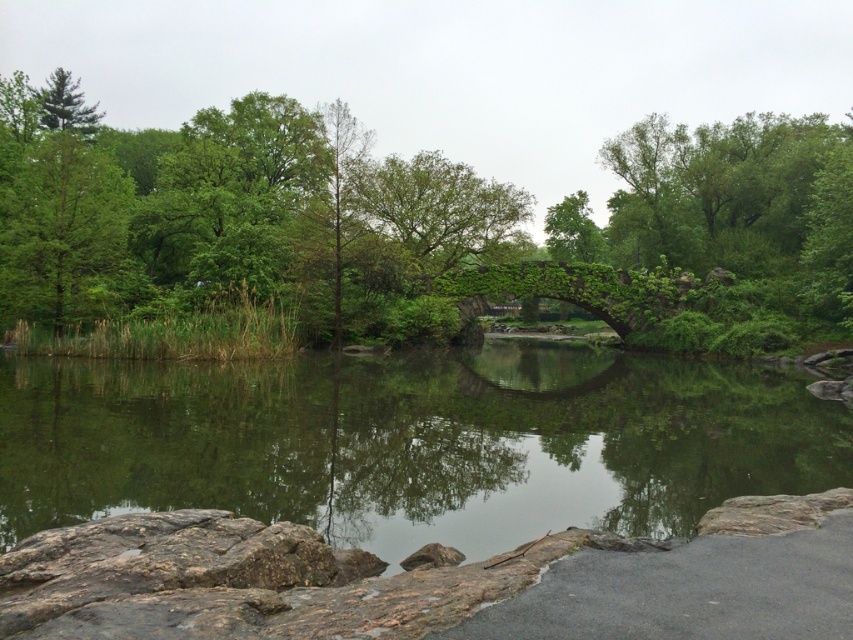
Question: Estimate the real-world distances between objects in this image. Which object is closer to the green ivy-covered bridge at center?

Choices:
 (A) green leafy tree at center
 (B) green reflective water at center

Answer: (A)

Question: Can you confirm if green leafy tree at center is wider than green ivy-covered bridge at center?

Choices:
 (A) yes
 (B) no

Answer: (A)

Question: Which of the following is the farthest from the observer?

Choices:
 (A) green reflective water at center
 (B) green leafy tree at center
 (C) green ivy-covered bridge at center

Answer: (C)

Question: Is green leafy tree at center below green leafy tree at upper left?

Choices:
 (A) yes
 (B) no

Answer: (A)

Question: Is green reflective water at center bigger than green leafy tree at left?

Choices:
 (A) no
 (B) yes

Answer: (A)

Question: Which point is closer to the camera?

Choices:
 (A) (184, 392)
 (B) (666, 237)
 (C) (61, 276)
 (D) (39, 108)

Answer: (A)